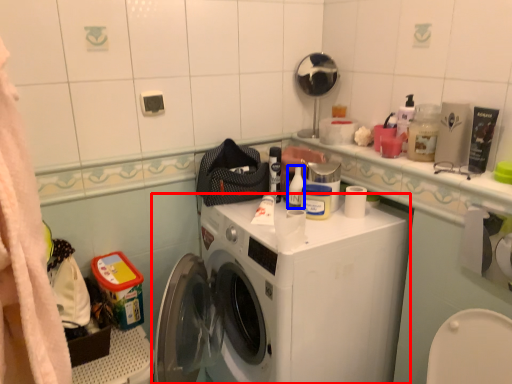
Question: Which of the following is the farthest to the observer, washing machine (highlighted by a red box) or toiletry (highlighted by a blue box)?

Choices:
 (A) washing machine
 (B) toiletry

Answer: (B)